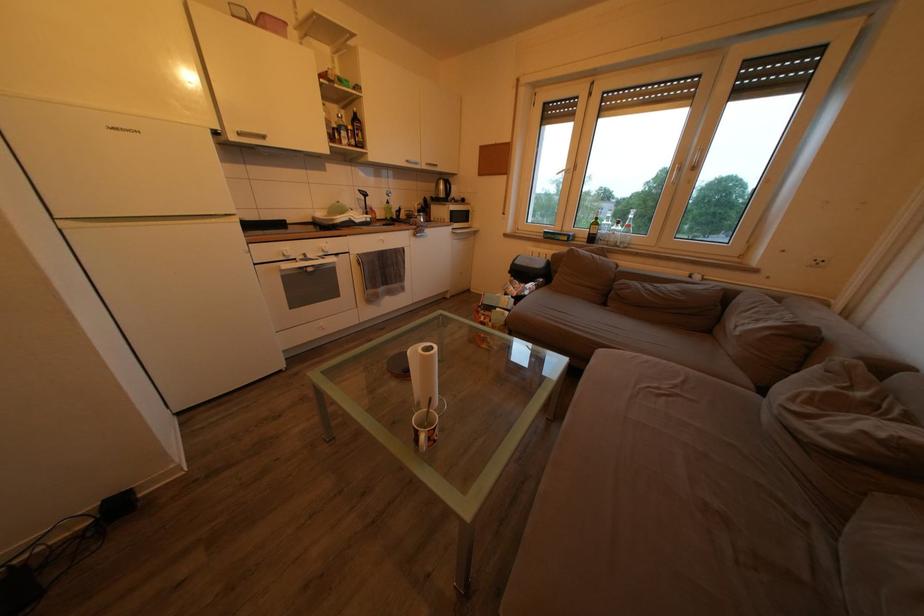
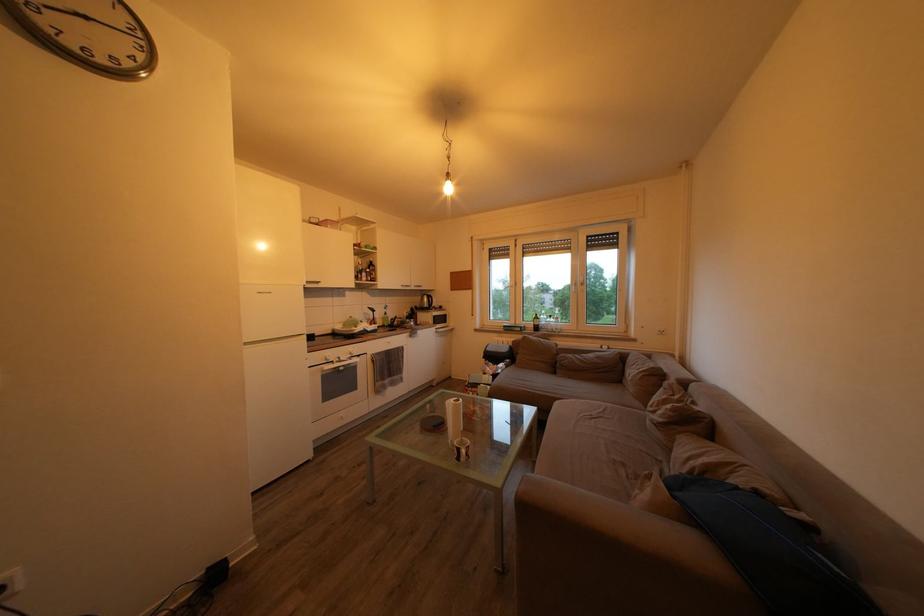
Locate, in the second image, the point that corresponds to (x=327, y=221) in the first image.

(346, 333)